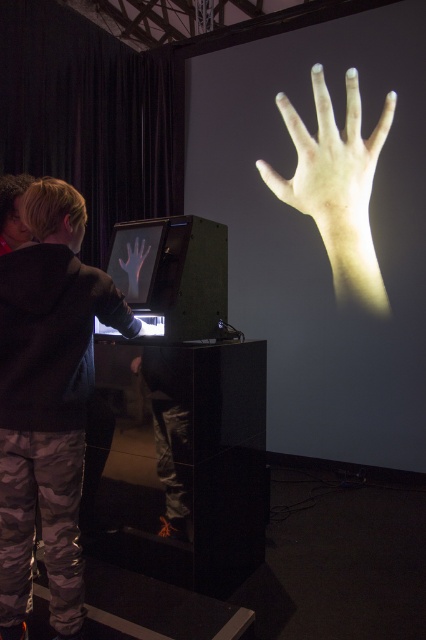
Between light beige skin at upper center and matte black hand at center, which one has less height?

matte black hand at center is shorter.

You are a GUI agent. You are given a task and a screenshot of the screen. Output one action in this format:
    pyautogui.click(x=<x>, y=<y>)
    Task: Click on the light beige skin at upper center
    The height and width of the screenshot is (640, 426).
    Given the screenshot: What is the action you would take?
    pyautogui.click(x=331, y=163)

Is camouflage pants at lower left smaller than light beige skin at upper center?

Correct, camouflage pants at lower left occupies less space than light beige skin at upper center.

Who is taller, camouflage pants at lower left or light beige skin at upper center?

With more height is light beige skin at upper center.

What do you see at coordinates (48, 401) in the screenshot? The image size is (426, 640). I see `camouflage pants at lower left` at bounding box center [48, 401].

Identify the location of camouflage pants at lower left. Image resolution: width=426 pixels, height=640 pixels. (48, 401).

Is camouflage pants at lower left closer to camera compared to matte black hand at center?

Yes.

Where is `camouflage pants at lower left`? Image resolution: width=426 pixels, height=640 pixels. camouflage pants at lower left is located at coordinates (48, 401).

Where is `camouflage pants at lower left`? The image size is (426, 640). camouflage pants at lower left is located at coordinates 48,401.

Locate an element on the screen. camouflage pants at lower left is located at coordinates (48, 401).